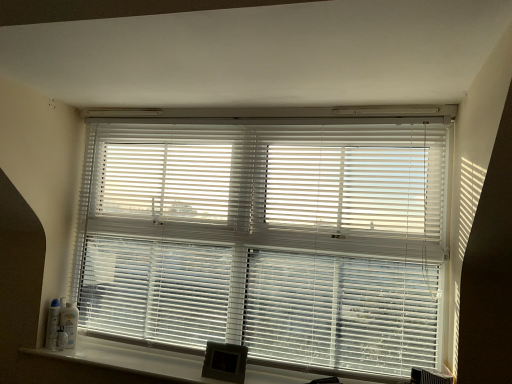
Identify the location of free spot above white smooth window sill at lower center (from a real-world perspective). click(165, 359).